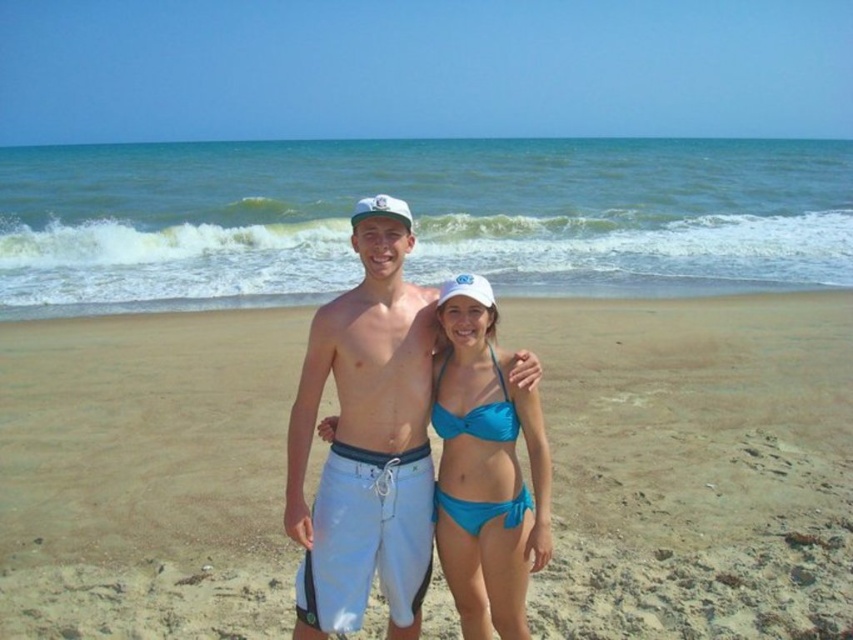
Question: Is smooth sand at center closer to camera compared to blue fabric bikini at center?

Choices:
 (A) no
 (B) yes

Answer: (A)

Question: Where is white cotton shorts at center located in relation to blue fabric bikini at center in the image?

Choices:
 (A) right
 (B) left

Answer: (B)

Question: Which of the following is the farthest from the observer?

Choices:
 (A) matte blue bikini at center
 (B) blue fabric bikini at center

Answer: (A)

Question: Which point is closer to the camera taking this photo?

Choices:
 (A) (523, 492)
 (B) (473, 448)
 (C) (397, 209)
 (D) (100, 589)

Answer: (C)

Question: Does blue fabric bikini at center have a smaller size compared to matte blue bikini at center?

Choices:
 (A) yes
 (B) no

Answer: (B)

Question: Among these objects, which one is farthest from the camera?

Choices:
 (A) matte blue bikini at center
 (B) white cotton shorts at center
 (C) white matte baseball cap at center

Answer: (C)